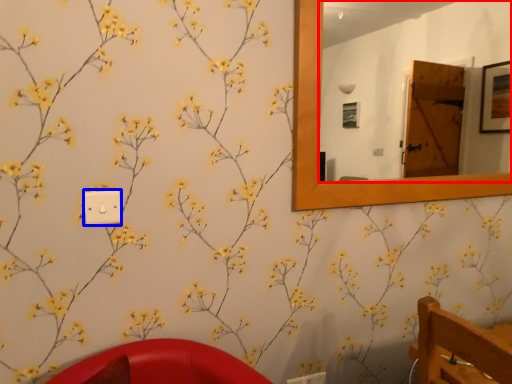
Question: Which point is closer to the camera, mirror (highlighted by a red box) or light switch (highlighted by a blue box)?

Choices:
 (A) mirror
 (B) light switch

Answer: (B)